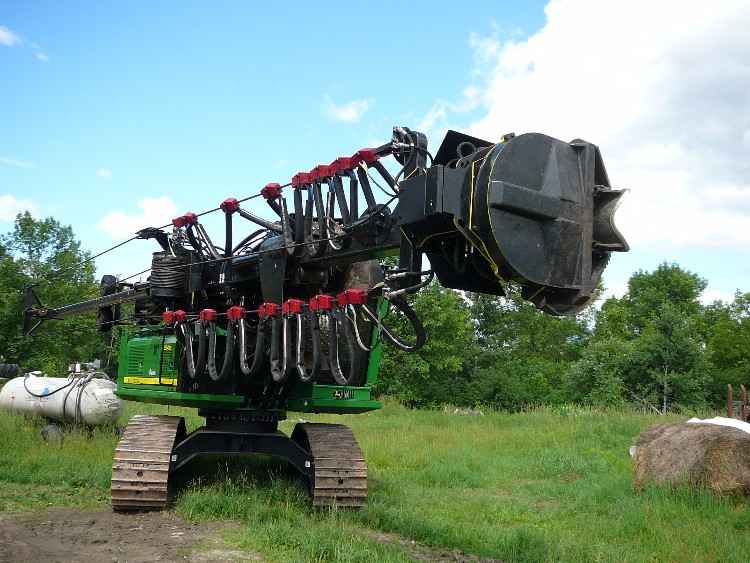
Where is `wires`? wires is located at coordinates (106, 250), (211, 205), (249, 193), (142, 268).